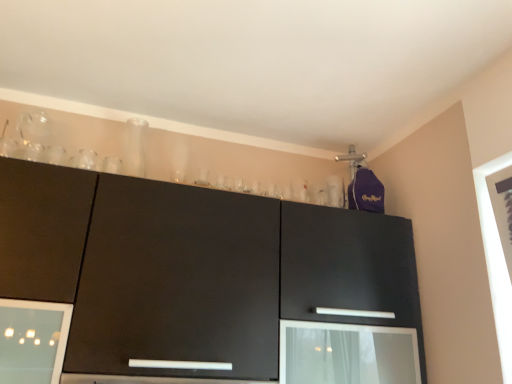
Question: Considering the relative sizes of matte black cabinet at upper center and transparent glass screen door at lower center in the image provided, is matte black cabinet at upper center wider than transparent glass screen door at lower center?

Choices:
 (A) yes
 (B) no

Answer: (A)

Question: From a real-world perspective, is matte black cabinet at upper center on transparent glass screen door at lower center?

Choices:
 (A) no
 (B) yes

Answer: (B)

Question: Is matte black cabinet at upper center further to camera compared to transparent glass screen door at lower center?

Choices:
 (A) no
 (B) yes

Answer: (A)

Question: Can you confirm if matte black cabinet at upper center is shorter than transparent glass screen door at lower center?

Choices:
 (A) no
 (B) yes

Answer: (A)

Question: Is matte black cabinet at upper center bigger than transparent glass screen door at lower center?

Choices:
 (A) no
 (B) yes

Answer: (B)

Question: Does matte black cabinet at upper center come in front of transparent glass screen door at lower center?

Choices:
 (A) no
 (B) yes

Answer: (B)

Question: Can you confirm if transparent glass screen door at lower center is thinner than matte black cabinet at upper center?

Choices:
 (A) no
 (B) yes

Answer: (B)

Question: Considering the relative sizes of transparent glass screen door at lower center and matte black cabinet at upper center in the image provided, is transparent glass screen door at lower center taller than matte black cabinet at upper center?

Choices:
 (A) no
 (B) yes

Answer: (A)

Question: Does transparent glass screen door at lower center have a greater width compared to matte black cabinet at upper center?

Choices:
 (A) no
 (B) yes

Answer: (A)

Question: From the image's perspective, is transparent glass screen door at lower center on matte black cabinet at upper center?

Choices:
 (A) no
 (B) yes

Answer: (A)

Question: Can you confirm if transparent glass screen door at lower center is positioned to the right of matte black cabinet at upper center?

Choices:
 (A) yes
 (B) no

Answer: (A)

Question: Does transparent glass screen door at lower center come behind matte black cabinet at upper center?

Choices:
 (A) yes
 (B) no

Answer: (A)

Question: Looking at the image, does matte black cabinet at upper center seem bigger or smaller compared to transparent glass screen door at lower center?

Choices:
 (A) small
 (B) big

Answer: (B)